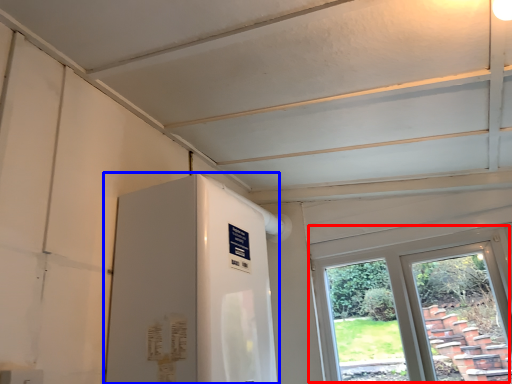
Question: Which object appears closest to the camera in this image, window (highlighted by a red box) or water heater (highlighted by a blue box)?

Choices:
 (A) window
 (B) water heater

Answer: (B)